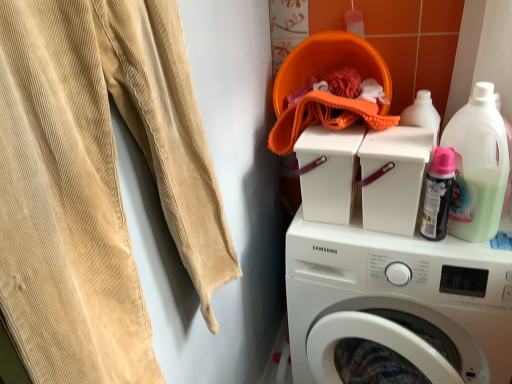
What are the coordinates of `free location in front of matte black spray can at upper right` in the screenshot? It's located at (453, 253).